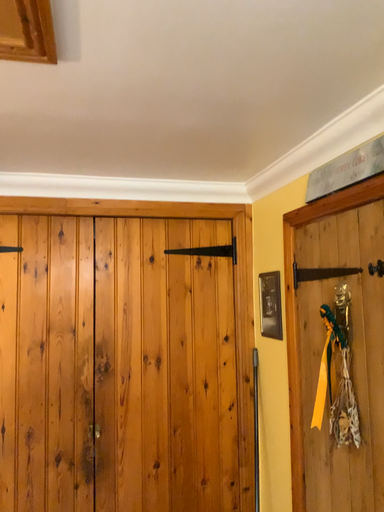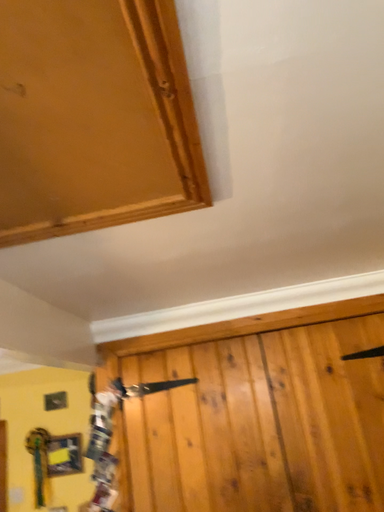
Question: Which way did the camera rotate in the video?

Choices:
 (A) rotated left
 (B) rotated right

Answer: (A)